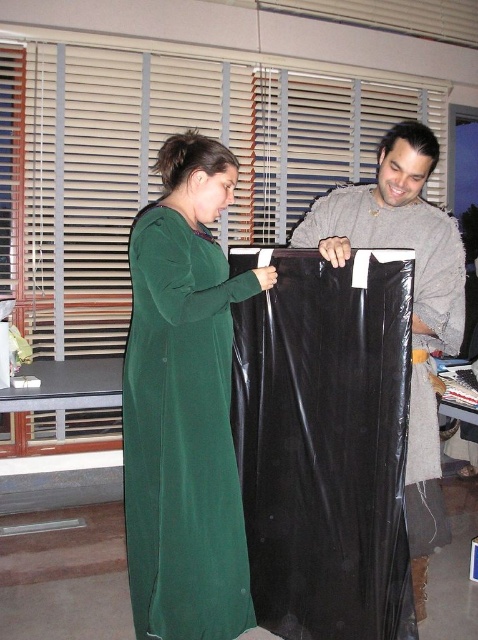
Which of these two, green velvet dress at center or matte black plastic bag at center, stands taller?

With more height is matte black plastic bag at center.

Is green velvet dress at center positioned behind matte black plastic bag at center?

Yes, green velvet dress at center is further from the viewer.

Is point (210, 236) more distant than point (340, 246)?

Yes.

I want to click on green velvet dress at center, so click(x=184, y=404).

Is the position of black plastic bag at center more distant than that of green velvet dress at center?

No.

Can you confirm if black plastic bag at center is positioned below green velvet dress at center?

Correct, black plastic bag at center is located below green velvet dress at center.

Between point (372, 300) and point (215, 177), which one is positioned in front?

Point (372, 300)

The height and width of the screenshot is (640, 478). In order to click on black plastic bag at center in this screenshot , I will do `click(325, 442)`.

Does black plastic bag at center have a lesser width compared to matte black plastic bag at center?

Indeed, black plastic bag at center has a lesser width compared to matte black plastic bag at center.

Does black plastic bag at center appear on the left side of matte black plastic bag at center?

Correct, you'll find black plastic bag at center to the left of matte black plastic bag at center.

Is point (306, 269) farther from camera compared to point (422, 502)?

No, it is in front of (422, 502).

The width and height of the screenshot is (478, 640). I want to click on black plastic bag at center, so click(x=325, y=442).